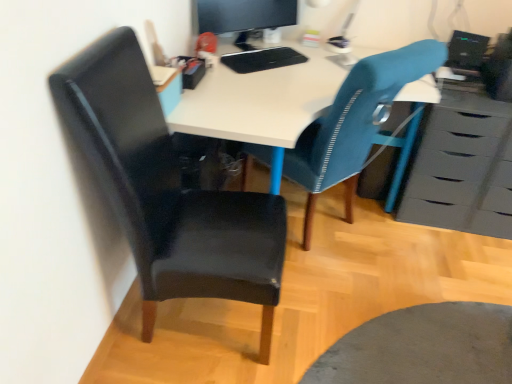
Question: Can you confirm if matte black monitor at upper center is positioned to the right of textured blue chair at center, arranged as the 1th chair when viewed from the right?

Choices:
 (A) no
 (B) yes

Answer: (A)

Question: From a real-world perspective, is matte black monitor at upper center located beneath textured blue chair at center, arranged as the 1th chair when viewed from the right?

Choices:
 (A) no
 (B) yes

Answer: (A)

Question: Is matte black monitor at upper center further to camera compared to textured blue chair at center, arranged as the 1th chair when viewed from the right?

Choices:
 (A) yes
 (B) no

Answer: (A)

Question: Considering the relative sizes of matte black monitor at upper center and textured blue chair at center, arranged as the 1th chair when viewed from the right, in the image provided, is matte black monitor at upper center thinner than textured blue chair at center, arranged as the 1th chair when viewed from the right,?

Choices:
 (A) yes
 (B) no

Answer: (A)

Question: Could you tell me if matte black monitor at upper center is turned towards textured blue chair at center, the 2th chair positioned from the left?

Choices:
 (A) no
 (B) yes

Answer: (B)

Question: Considering the relative sizes of matte black monitor at upper center and textured blue chair at center, arranged as the 1th chair when viewed from the right, in the image provided, is matte black monitor at upper center smaller than textured blue chair at center, arranged as the 1th chair when viewed from the right,?

Choices:
 (A) no
 (B) yes

Answer: (B)

Question: Can you confirm if textured blue chair at center, the 2th chair positioned from the left, is bigger than matte black monitor at upper center?

Choices:
 (A) yes
 (B) no

Answer: (A)

Question: Is textured blue chair at center, the 2th chair positioned from the left, thinner than matte black monitor at upper center?

Choices:
 (A) yes
 (B) no

Answer: (B)

Question: Is textured blue chair at center, the 2th chair positioned from the left, behind matte black monitor at upper center?

Choices:
 (A) no
 (B) yes

Answer: (A)

Question: Are textured blue chair at center, arranged as the 1th chair when viewed from the right, and matte black monitor at upper center far apart?

Choices:
 (A) yes
 (B) no

Answer: (B)

Question: Is textured blue chair at center, the 2th chair positioned from the left, positioned beyond the bounds of matte black monitor at upper center?

Choices:
 (A) yes
 (B) no

Answer: (A)

Question: Is textured blue chair at center, arranged as the 1th chair when viewed from the right, wider than matte black monitor at upper center?

Choices:
 (A) yes
 (B) no

Answer: (A)

Question: From the image's perspective, is black glossy computer at upper right under black leather chair at left, acting as the 1th chair starting from the left?

Choices:
 (A) yes
 (B) no

Answer: (B)